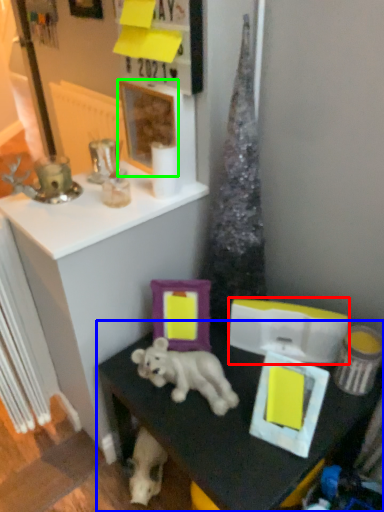
Question: Which object is the farthest from box (highlighted by a red box)? Choose among these: table (highlighted by a blue box) or picture frame (highlighted by a green box).

Choices:
 (A) table
 (B) picture frame

Answer: (B)